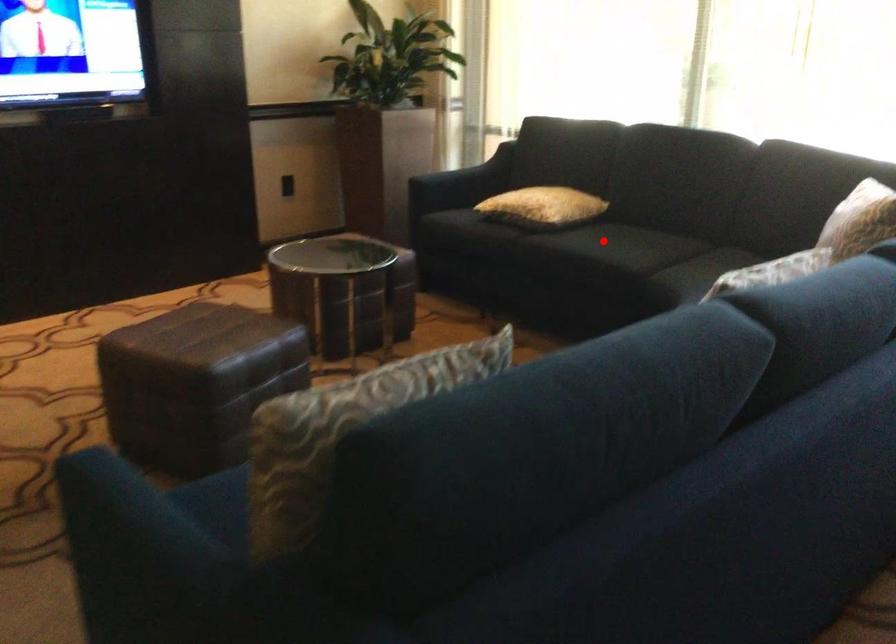
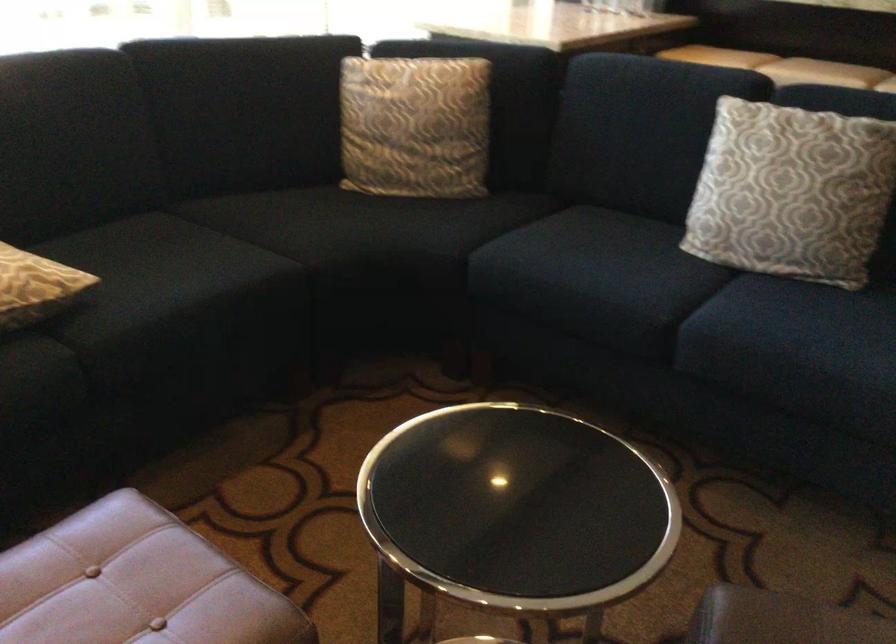
Question: A red point is marked in image1. In image2, is the corresponding 3D point closer to the camera or farther? Reply with the corresponding letter.

Choices:
 (A) The corresponding 3D point is closer.
 (B) The corresponding 3D point is farther.

Answer: (A)